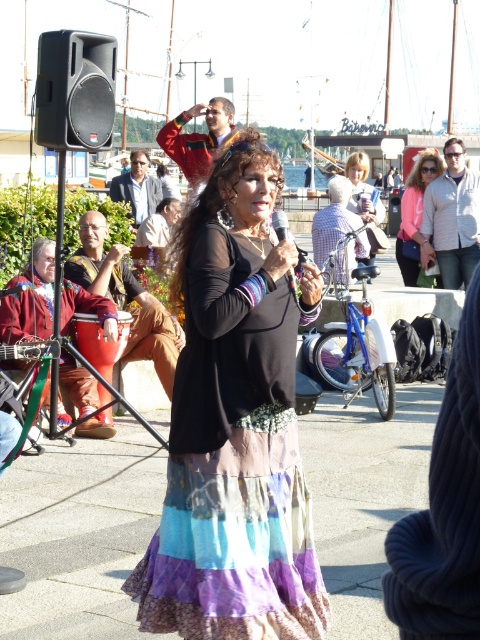
Question: Considering the real-world distances, which object is closest to the black plastic speaker at upper left?

Choices:
 (A) brown leather drum at center
 (B) pink fabric purse at center
 (C) multicolored patchwork skirt at center
 (D) light brown hair at center

Answer: (A)

Question: Does pink fabric purse at center have a greater width compared to light brown hair at center?

Choices:
 (A) no
 (B) yes

Answer: (B)

Question: Is the position of multicolored patchwork skirt at center more distant than that of black plastic speaker at upper left?

Choices:
 (A) no
 (B) yes

Answer: (A)

Question: Does black plastic speaker at upper left have a lesser width compared to brown leather drum at center?

Choices:
 (A) no
 (B) yes

Answer: (B)

Question: Among these points, which one is farthest from the camera?

Choices:
 (A) (421, 176)
 (B) (216, 268)
 (C) (75, 44)

Answer: (A)

Question: Among these objects, which one is farthest from the camera?

Choices:
 (A) light brown hair at center
 (B) brown leather drum at center

Answer: (A)